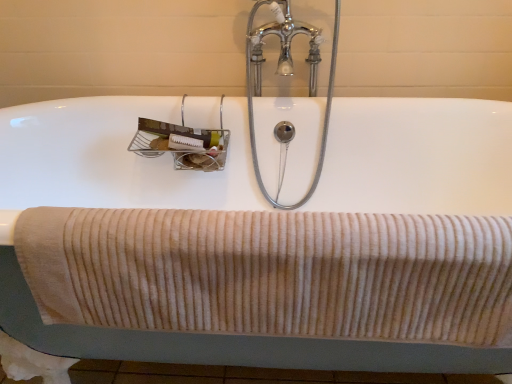
Question: Is beige corduroy towel at lower center directly adjacent to chrome/metallic faucet at upper center?

Choices:
 (A) no
 (B) yes

Answer: (A)

Question: Is beige corduroy towel at lower center at the left side of chrome/metallic faucet at upper center?

Choices:
 (A) no
 (B) yes

Answer: (B)

Question: Does beige corduroy towel at lower center come in front of chrome/metallic faucet at upper center?

Choices:
 (A) no
 (B) yes

Answer: (B)

Question: From a real-world perspective, is beige corduroy towel at lower center over chrome/metallic faucet at upper center?

Choices:
 (A) no
 (B) yes

Answer: (A)

Question: Can you confirm if beige corduroy towel at lower center is shorter than chrome/metallic faucet at upper center?

Choices:
 (A) no
 (B) yes

Answer: (B)

Question: Based on their sizes in the image, would you say chrome/metallic faucet at upper center is bigger or smaller than beige corduroy towel at lower center?

Choices:
 (A) big
 (B) small

Answer: (A)

Question: In the image, is chrome/metallic faucet at upper center positioned in front of or behind beige corduroy towel at lower center?

Choices:
 (A) behind
 (B) front

Answer: (A)

Question: From a real-world perspective, is chrome/metallic faucet at upper center positioned above or below beige corduroy towel at lower center?

Choices:
 (A) above
 (B) below

Answer: (A)

Question: From their relative heights in the image, would you say chrome/metallic faucet at upper center is taller or shorter than beige corduroy towel at lower center?

Choices:
 (A) short
 (B) tall

Answer: (B)

Question: Is chrome/metallic faucet at upper center bigger or smaller than white ceramic bath at center?

Choices:
 (A) small
 (B) big

Answer: (A)

Question: From a real-world perspective, is chrome/metallic faucet at upper center physically located above or below white ceramic bath at center?

Choices:
 (A) below
 (B) above

Answer: (B)

Question: From the image's perspective, is chrome/metallic faucet at upper center positioned above or below white ceramic bath at center?

Choices:
 (A) above
 (B) below

Answer: (A)

Question: Does point (253, 54) appear closer or farther from the camera than point (395, 115)?

Choices:
 (A) closer
 (B) farther

Answer: (B)

Question: Considering the positions of beige corduroy towel at lower center and chrome/metallic faucet at upper center in the image, is beige corduroy towel at lower center wider or thinner than chrome/metallic faucet at upper center?

Choices:
 (A) thin
 (B) wide

Answer: (A)

Question: Is point click(167, 314) positioned closer to the camera than point click(289, 26)?

Choices:
 (A) farther
 (B) closer

Answer: (B)